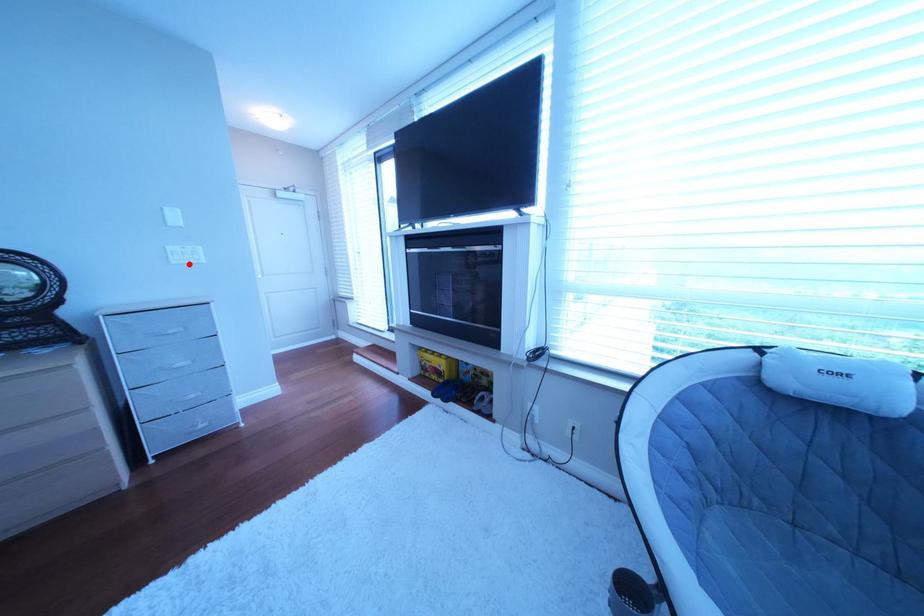
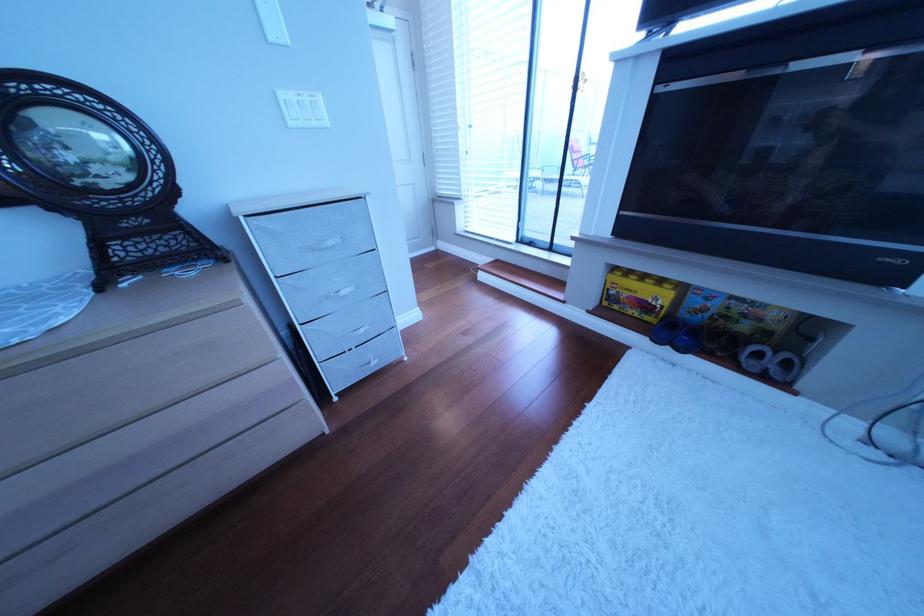
Find the pixel in the second image that matches the highlighted location in the first image.

(307, 126)